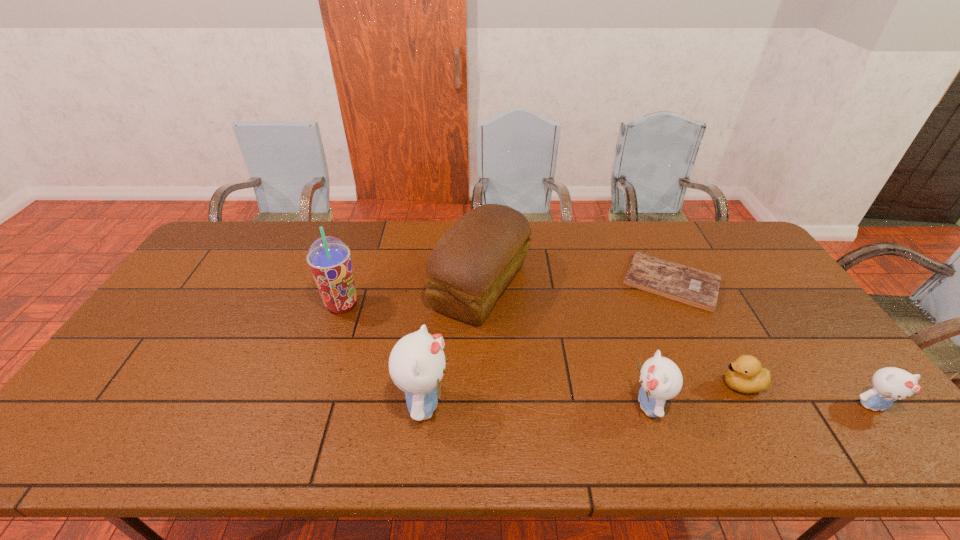
At what (x,y) coordinates should I click in order to perform the action: click on unoccupied position between the rightmost kitten and the second shortest kitten. Please return your answer as a coordinate pair (x, y). This screenshot has height=540, width=960. Looking at the image, I should click on (760, 405).

I want to click on vacant area that lies between the sixth tallest object and the tallest object, so click(x=541, y=345).

This screenshot has height=540, width=960. What are the coordinates of `unoccupied area between the shortest object and the duckling` in the screenshot? It's located at (707, 334).

The height and width of the screenshot is (540, 960). Find the location of `vacant point located between the shortest kitten and the bread`. vacant point located between the shortest kitten and the bread is located at coordinates (677, 346).

Where is `free space between the second shortest object and the shortest object`? This screenshot has height=540, width=960. free space between the second shortest object and the shortest object is located at coordinates click(x=707, y=334).

In order to click on free space between the leftmost object and the leftmost kitten in this screenshot , I will do `click(383, 354)`.

At what (x,y) coordinates should I click in order to perform the action: click on blank region between the tallest kitten and the fourth shortest object. Please return your answer as a coordinate pair (x, y). The image size is (960, 540). Looking at the image, I should click on (536, 404).

The width and height of the screenshot is (960, 540). I want to click on vacant point located between the rightmost kitten and the smoothie, so click(608, 355).

Locate an element on the screen. The image size is (960, 540). vacant region between the leftmost kitten and the bread is located at coordinates (452, 345).

The height and width of the screenshot is (540, 960). Find the location of `the fifth closest object to the Bible`. the fifth closest object to the Bible is located at coordinates (417, 362).